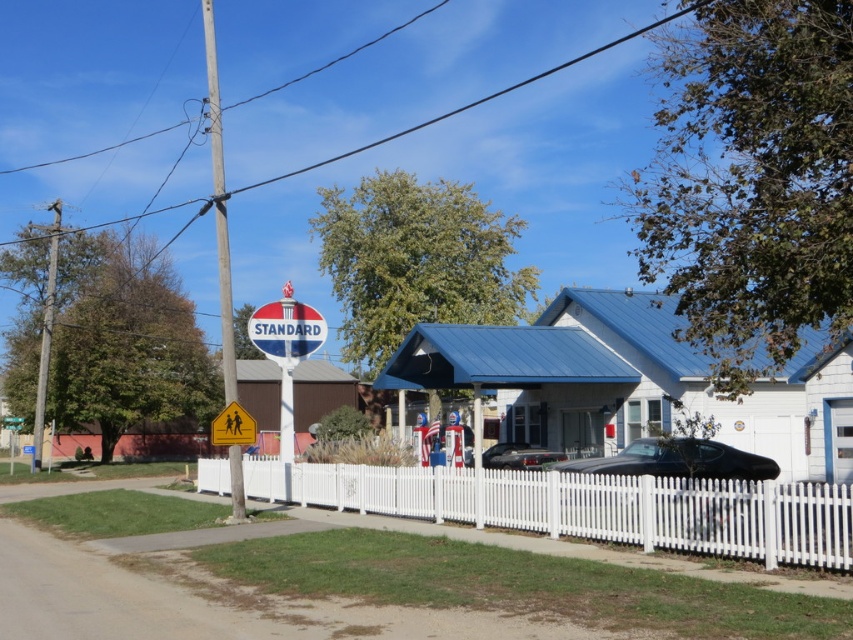
Does white picket fence at center have a lesser width compared to yellow plastic pedestrian crossing sign at center?

No, white picket fence at center is not thinner than yellow plastic pedestrian crossing sign at center.

Between white picket fence at center and yellow plastic pedestrian crossing sign at center, which one appears on the left side from the viewer's perspective?

From the viewer's perspective, yellow plastic pedestrian crossing sign at center appears more on the left side.

Where is `white picket fence at center`? white picket fence at center is located at coordinates (589, 506).

This screenshot has height=640, width=853. What do you see at coordinates (589, 506) in the screenshot? I see `white picket fence at center` at bounding box center [589, 506].

In the scene shown: Measure the distance between white picket fence at center and shiny black car at center.

white picket fence at center is 26.54 feet away from shiny black car at center.

Measure the distance between white picket fence at center and camera.

white picket fence at center is 38.44 feet away from camera.

Find the location of a particular element. white picket fence at center is located at coordinates (589, 506).

Is smooth wooden utility pole at left positioned before shiny black car at center?

No, smooth wooden utility pole at left is further to the viewer.

Is smooth wooden utility pole at left taller than shiny black car at center?

Yes, smooth wooden utility pole at left is taller than shiny black car at center.

Where is `smooth wooden utility pole at left`? smooth wooden utility pole at left is located at coordinates (45, 332).

You are a GUI agent. You are given a task and a screenshot of the screen. Output one action in this format:
    pyautogui.click(x=<x>, y=<y>)
    Task: Click on the smooth wooden utility pole at left
    
    Given the screenshot: What is the action you would take?
    pyautogui.click(x=45, y=332)